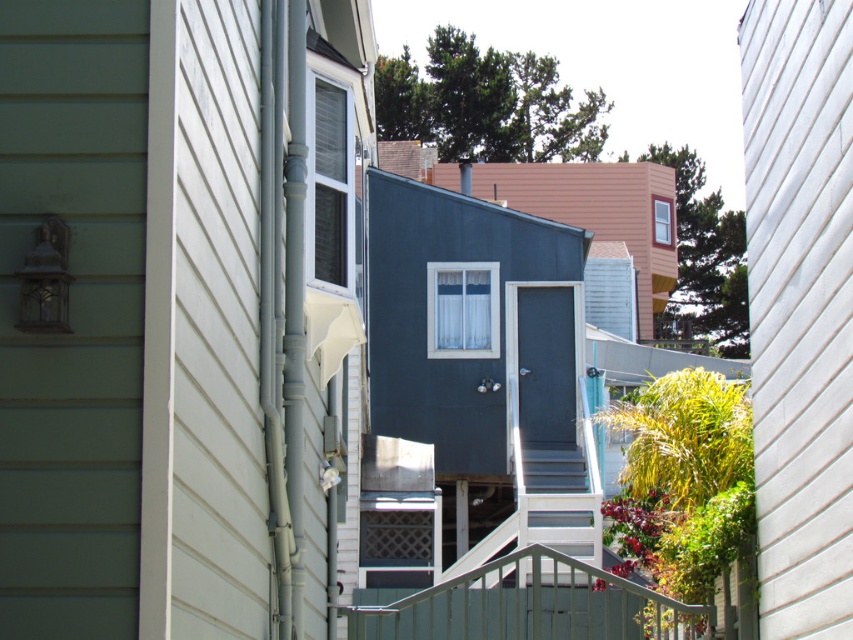
Question: Which point is farther to the camera?

Choices:
 (A) (490, 289)
 (B) (254, 568)
 (C) (606, 298)
 (D) (334, 269)

Answer: (C)

Question: Which is farther from the white smooth siding at right?

Choices:
 (A) white plastic window at center
 (B) white glossy stairs at center

Answer: (B)

Question: Is green painted wood siding at left to the left of metallic gray balustrade at center from the viewer's perspective?

Choices:
 (A) yes
 (B) no

Answer: (A)

Question: Which object appears closest to the camera in this image?

Choices:
 (A) white matte shutter at upper center
 (B) white plastic window at center

Answer: (B)

Question: Is white painted wood siding at left to the left of white plastic window at center from the viewer's perspective?

Choices:
 (A) no
 (B) yes

Answer: (B)

Question: Can you confirm if green painted wood siding at left is thinner than white painted wood siding at left?

Choices:
 (A) yes
 (B) no

Answer: (B)